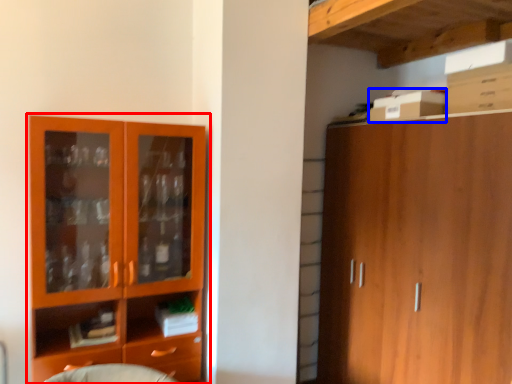
Question: Which object appears farthest to the camera in this image, cupboard (highlighted by a red box) or cardboard box (highlighted by a blue box)?

Choices:
 (A) cupboard
 (B) cardboard box

Answer: (B)